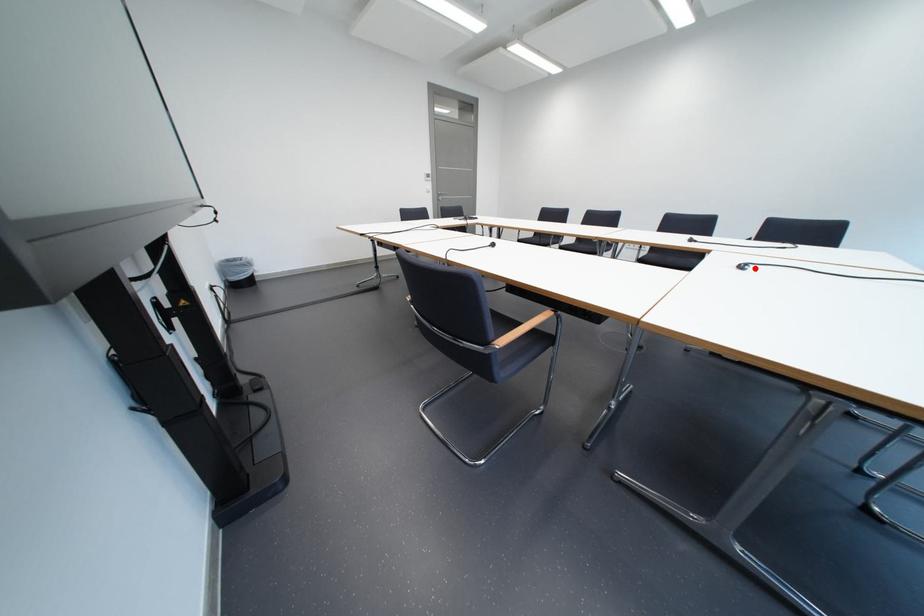
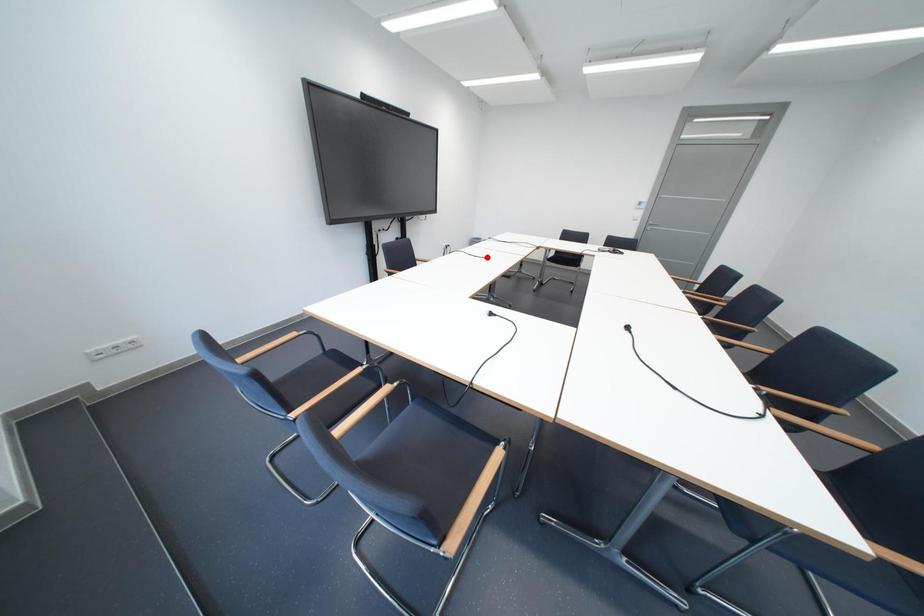
I am providing you with two images of the same scene from different viewpoints. A red point is marked on the first image and another point is marked on the second image. Do the highlighted points in image1 and image2 indicate the same real-world spot?

No